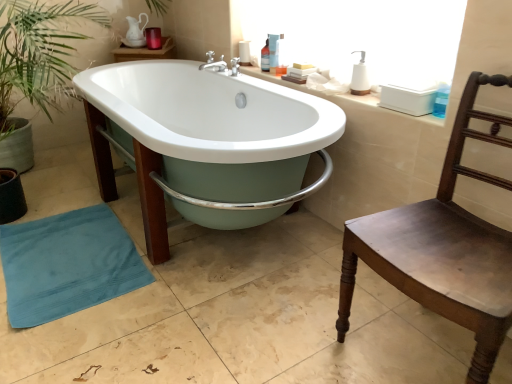
Question: From a real-world perspective, does brown wooden chair at right stand above translucent plastic soap dispenser at upper center, acting as the second toiletry starting from the right?

Choices:
 (A) no
 (B) yes

Answer: (A)

Question: Is brown wooden chair at right thinner than translucent plastic soap dispenser at upper center, which is the third toiletry in left-to-right order?

Choices:
 (A) no
 (B) yes

Answer: (A)

Question: Is brown wooden chair at right turned away from translucent plastic soap dispenser at upper center, which is the third toiletry in left-to-right order?

Choices:
 (A) yes
 (B) no

Answer: (B)

Question: Can translucent plastic soap dispenser at upper center, which is the third toiletry in left-to-right order, be found inside brown wooden chair at right?

Choices:
 (A) no
 (B) yes

Answer: (A)

Question: Can you confirm if brown wooden chair at right is positioned to the left of translucent plastic soap dispenser at upper center, the second toiletry when ordered from front to back?

Choices:
 (A) no
 (B) yes

Answer: (A)

Question: From a real-world perspective, is brown wooden chair at right beneath translucent plastic soap dispenser at upper center, which is the third toiletry in left-to-right order?

Choices:
 (A) yes
 (B) no

Answer: (A)

Question: From a real-world perspective, is white ceramic counter top at upper right located beneath translucent plastic bottle at upper center, placed as the 4th toiletry when sorted from right to left?

Choices:
 (A) no
 (B) yes

Answer: (B)

Question: Considering the relative sizes of white ceramic counter top at upper right and translucent plastic bottle at upper center, which is the first toiletry from left to right, in the image provided, is white ceramic counter top at upper right thinner than translucent plastic bottle at upper center, which is the first toiletry from left to right,?

Choices:
 (A) yes
 (B) no

Answer: (B)

Question: From a real-world perspective, is white ceramic counter top at upper right on top of translucent plastic bottle at upper center, placed as the 4th toiletry when sorted from front to back?

Choices:
 (A) yes
 (B) no

Answer: (B)

Question: Is white ceramic counter top at upper right facing away from translucent plastic bottle at upper center, which is the first toiletry from left to right?

Choices:
 (A) yes
 (B) no

Answer: (B)

Question: Can you confirm if white ceramic counter top at upper right is bigger than translucent plastic bottle at upper center, placed as the 4th toiletry when sorted from front to back?

Choices:
 (A) yes
 (B) no

Answer: (A)

Question: Is white ceramic counter top at upper right aimed at translucent plastic bottle at upper center, which is the first toiletry from left to right?

Choices:
 (A) no
 (B) yes

Answer: (A)

Question: From the image's perspective, does translucent plastic bottle at upper center, placed as the 4th toiletry when sorted from front to back, appear higher than white glossy bathtub at center?

Choices:
 (A) no
 (B) yes

Answer: (B)